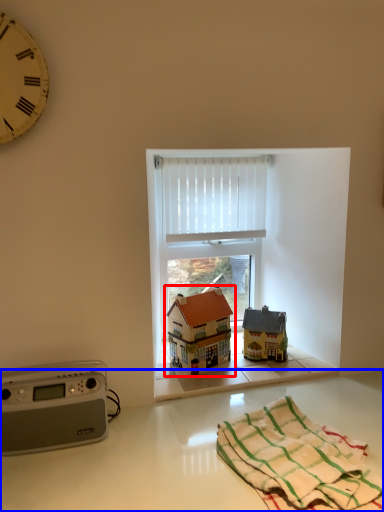
Question: Which point is closer to the camera, toy (highlighted by a red box) or counter top (highlighted by a blue box)?

Choices:
 (A) toy
 (B) counter top

Answer: (B)